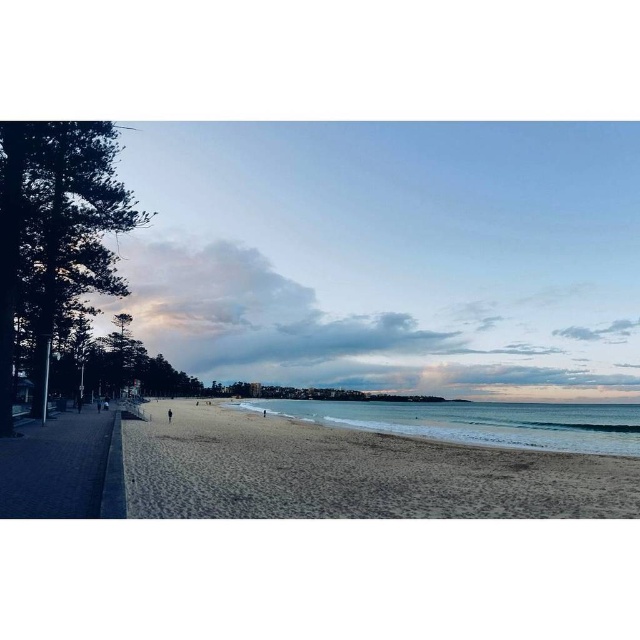
Who is lower down, beige sandy beach at center or blue water at lower center?

blue water at lower center

Who is taller, beige sandy beach at center or blue water at lower center?

blue water at lower center

I want to click on beige sandy beach at center, so click(x=353, y=472).

Image resolution: width=640 pixels, height=640 pixels. I want to click on beige sandy beach at center, so click(353, 472).